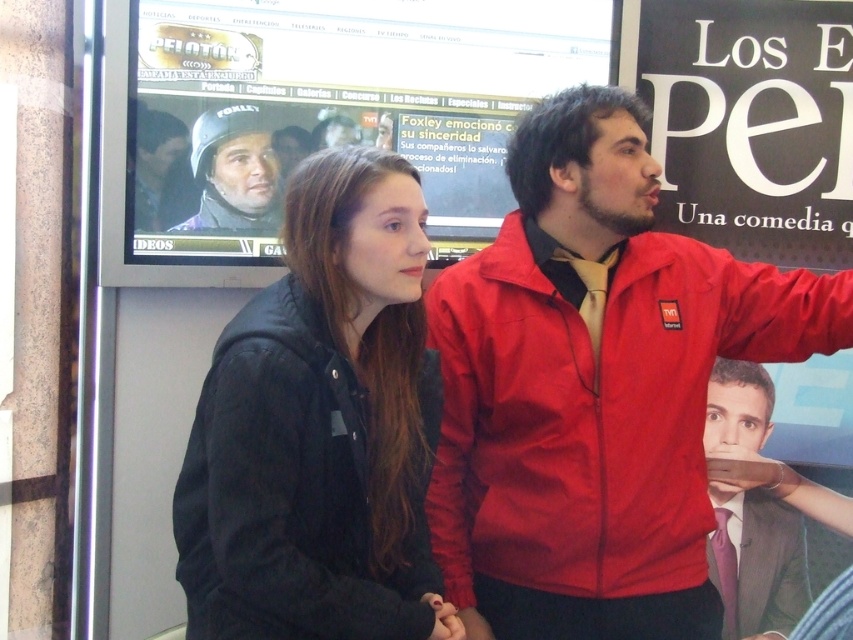
Question: Which point is farther to the camera?

Choices:
 (A) (448, 618)
 (B) (236, 129)
 (C) (138, 193)
 (D) (763, 513)

Answer: (D)

Question: Can you confirm if smooth suit at center is bigger than matte black helmet at upper center?

Choices:
 (A) yes
 (B) no

Answer: (A)

Question: Is matte red jacket at center smaller than smooth suit at center?

Choices:
 (A) no
 (B) yes

Answer: (A)

Question: Which of the following is the farthest from the observer?

Choices:
 (A) (164, 208)
 (B) (751, 358)

Answer: (A)

Question: Considering the relative positions of matte red jacket at center and matte black helmet at upper center in the image provided, where is matte red jacket at center located with respect to matte black helmet at upper center?

Choices:
 (A) right
 (B) left

Answer: (A)

Question: Which point is farther to the camera?

Choices:
 (A) matte black jacket at center
 (B) matte black helmet at upper left

Answer: (B)